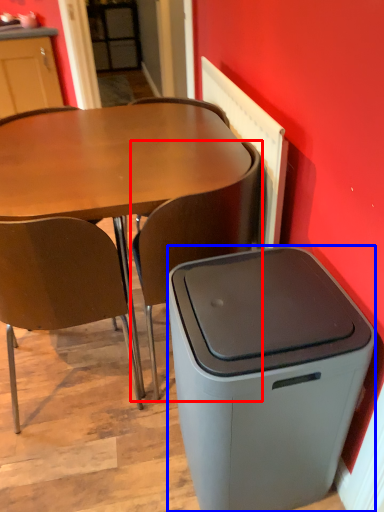
Question: Among these objects, which one is farthest to the camera, chair (highlighted by a red box) or trash bin/can (highlighted by a blue box)?

Choices:
 (A) chair
 (B) trash bin/can

Answer: (A)